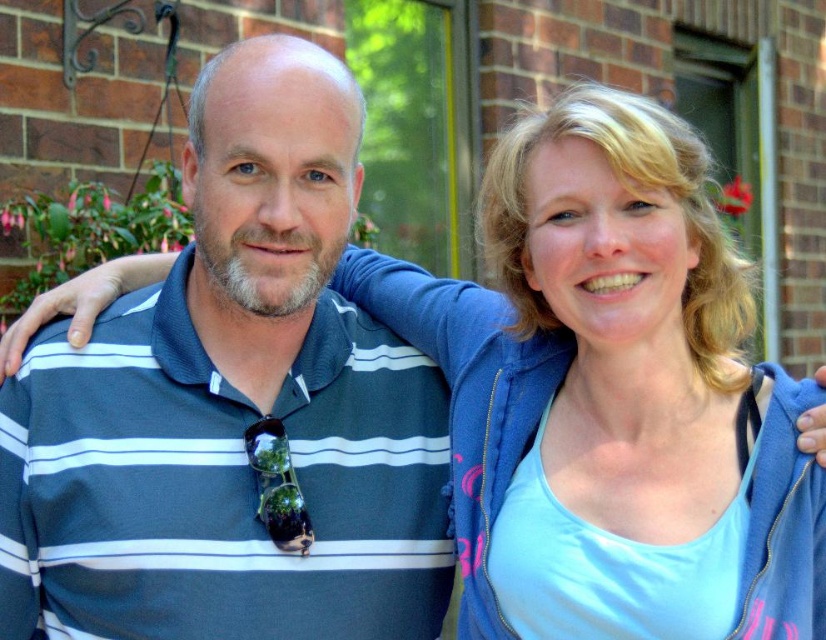
Between dark blue striped polo shirt at left and blue fleece jacket at upper right, which one has less height?

Standing shorter between the two is dark blue striped polo shirt at left.

Who is positioned more to the left, dark blue striped polo shirt at left or blue fleece jacket at upper right?

dark blue striped polo shirt at left is more to the left.

What do you see at coordinates (219, 484) in the screenshot? Image resolution: width=826 pixels, height=640 pixels. I see `dark blue striped polo shirt at left` at bounding box center [219, 484].

This screenshot has height=640, width=826. I want to click on dark blue striped polo shirt at left, so click(219, 484).